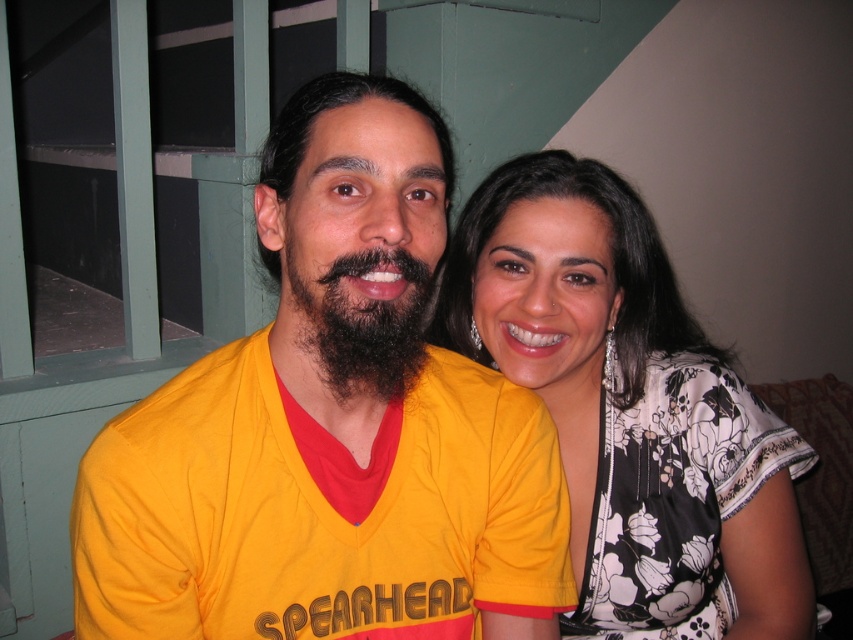
Question: Can you confirm if white floral blouse at upper right is positioned above dark brown curly beard at center?

Choices:
 (A) yes
 (B) no

Answer: (B)

Question: Which point is farther to the camera?

Choices:
 (A) dark brown curly beard at center
 (B) yellow fabric shirt at center
 (C) white floral blouse at upper right

Answer: (C)

Question: Is yellow fabric shirt at center smaller than white floral blouse at upper right?

Choices:
 (A) yes
 (B) no

Answer: (A)

Question: Which object is closer to the camera taking this photo?

Choices:
 (A) yellow fabric shirt at center
 (B) dark brown curly beard at center
 (C) white floral blouse at upper right

Answer: (A)

Question: Is yellow fabric shirt at center to the left of white floral blouse at upper right from the viewer's perspective?

Choices:
 (A) yes
 (B) no

Answer: (A)

Question: Which object appears closest to the camera in this image?

Choices:
 (A) dark brown curly beard at center
 (B) white floral blouse at upper right
 (C) yellow fabric shirt at center

Answer: (C)